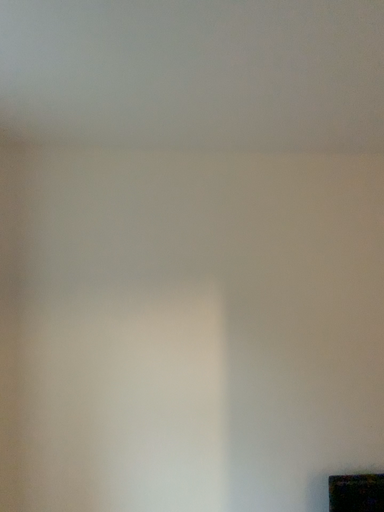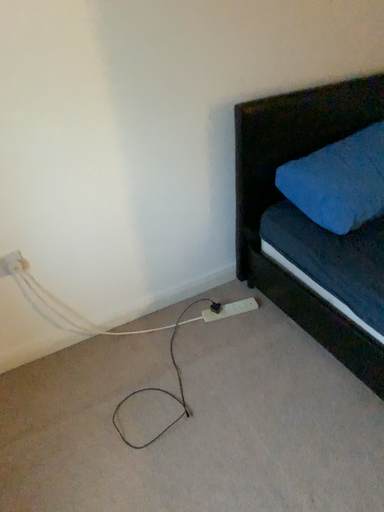
Question: Which way did the camera rotate in the video?

Choices:
 (A) rotated right
 (B) rotated left

Answer: (A)